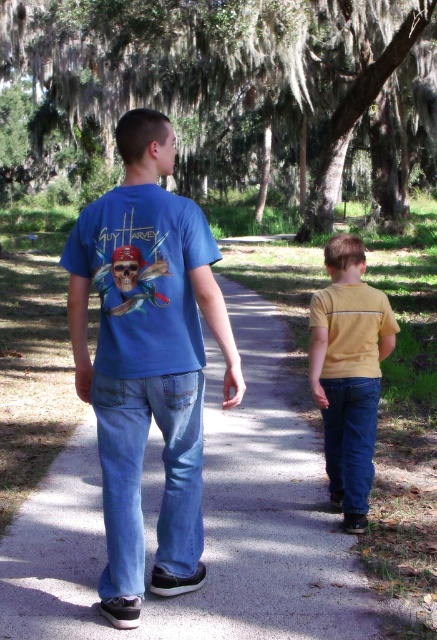
Question: Based on their relative distances, which object is farther from the smooth concrete path at center?

Choices:
 (A) blue cotton t-shirt at center
 (B) denim at right
 (C) yellow matte shirt at lower right
 (D) light blue denim jeans at center

Answer: (A)

Question: Among these points, which one is farthest from the camera?

Choices:
 (A) (353, 465)
 (B) (333, 616)

Answer: (A)

Question: Does smooth concrete path at center lie behind light blue denim jeans at center?

Choices:
 (A) yes
 (B) no

Answer: (A)

Question: Is blue cotton t-shirt at center closer to camera compared to denim at right?

Choices:
 (A) yes
 (B) no

Answer: (A)

Question: Is light blue denim jeans at center to the right of denim at right from the viewer's perspective?

Choices:
 (A) yes
 (B) no

Answer: (B)

Question: Which point is farther to the camera?

Choices:
 (A) light blue denim jeans at center
 (B) yellow matte shirt at lower right
 (C) denim at right
 (D) blue cotton t-shirt at center

Answer: (C)